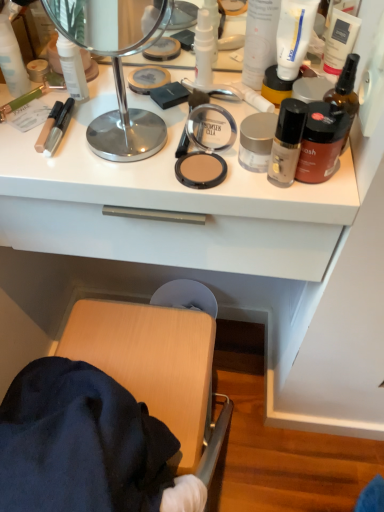
This screenshot has height=512, width=384. I want to click on vacant space situated on the left part of satin silver jar at upper center, which is the 4th toiletry from left to right, so click(x=130, y=151).